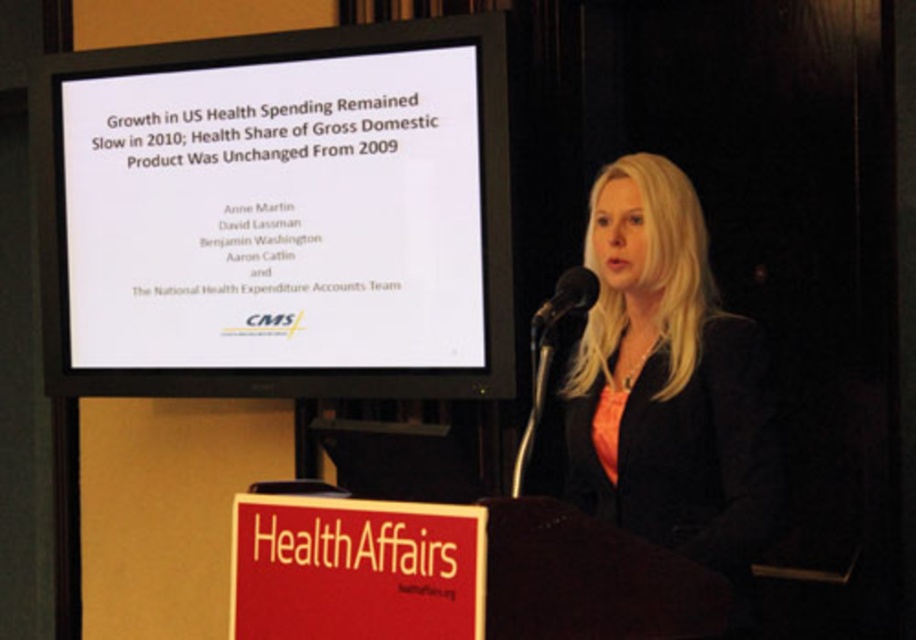
You are an attendee at the presentation and want to ask a question to the speaker. You need to determine which object is closer to you between the blonde hair at center and the black matte microphone at center. Which one is closer?

The blonde hair at center is closer to the viewer than the black matte microphone at center, so the blonde hair at center is closer to you.

You are an event photographer and need to capture a closeup shot of the blonde hair at center and the black matte microphone at center. Which object should you zoom in on to ensure it fills more of the frame?

The blonde hair at center is bigger than the black matte microphone at center, so you should zoom in on the blonde hair at center to ensure it fills more of the frame.

You are an event organizer who needs to adjust the lighting for a presentation. The projector requires a clear line of sight to the white glossy projector screen at upper center without obstruction from the black matte microphone at center. Is there enough space between them to prevent the microphone from casting a shadow on the screen?

The white glossy projector screen at upper center and the black matte microphone at center are 1.03 meters apart, so there is sufficient space to ensure the microphone does not obstruct the projector light path, preventing shadow casting on the screen.